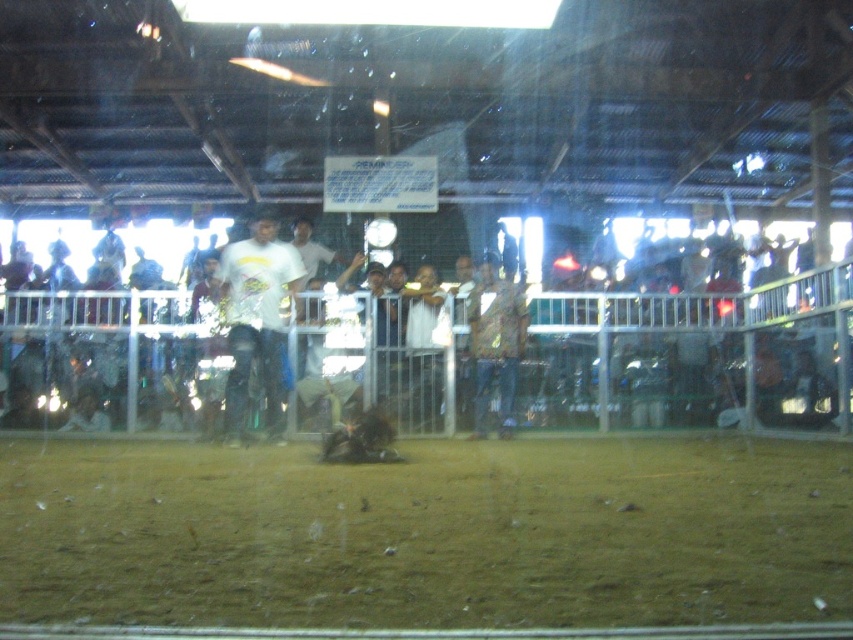
Question: Is brown dirt track at center smaller than white matte t-shirt at center?

Choices:
 (A) no
 (B) yes

Answer: (B)

Question: Does brown dirt track at center have a smaller size compared to white matte t-shirt at center?

Choices:
 (A) no
 (B) yes

Answer: (B)

Question: Does brown dirt track at center appear on the right side of white matte t-shirt at center?

Choices:
 (A) yes
 (B) no

Answer: (A)

Question: Which of the following is the farthest from the observer?

Choices:
 (A) (236, 435)
 (B) (79, 573)

Answer: (A)